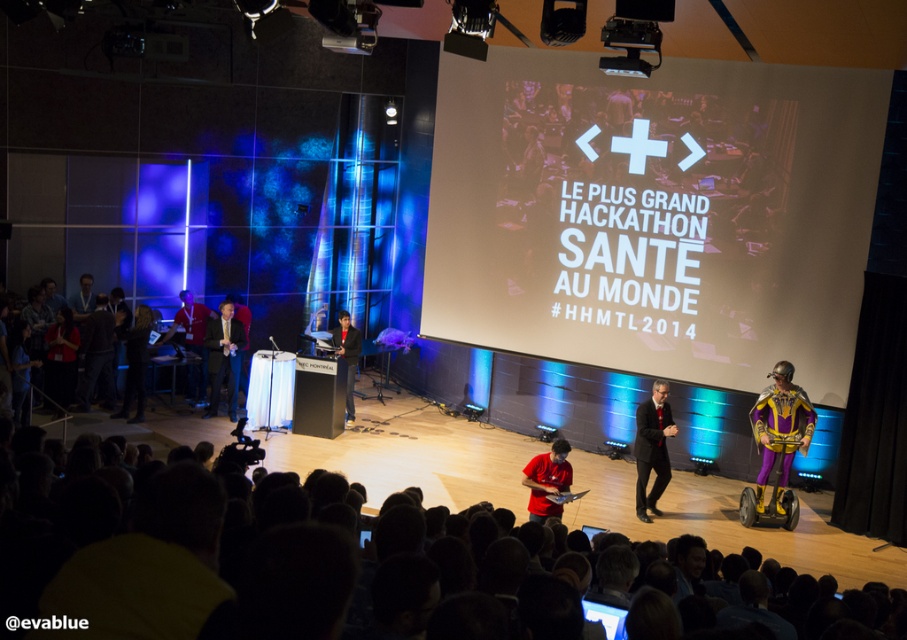
You are a photographer positioned at the back of the stage during the hackathon event. You want to take a photo of both the dark suit at center and the black leather jacket at center. Which one should you focus on first to ensure it appears sharp in the foreground?

The dark suit at center is further to the viewer than the black leather jacket at center, so you should focus on the dark suit at center first to ensure it appears sharp in the foreground.

You are a photographer at the hackathon event. You need to capture a clear photo of the black suit at center and the black leather jacket at center. Which one should you focus on first to ensure it appears sharp in the photo?

The black suit at center is in front of the black leather jacket at center, so you should focus on the black suit at center first to ensure it appears sharp in the photo.

You are standing at the front of the stage at the hackathon event. There are two points marked on the stage floor in front of you. One is at coordinates point [208,349] and the other is at point [348,413]. Which point is closer to you?

Point [208,349] is closer to the viewer than point [348,413].